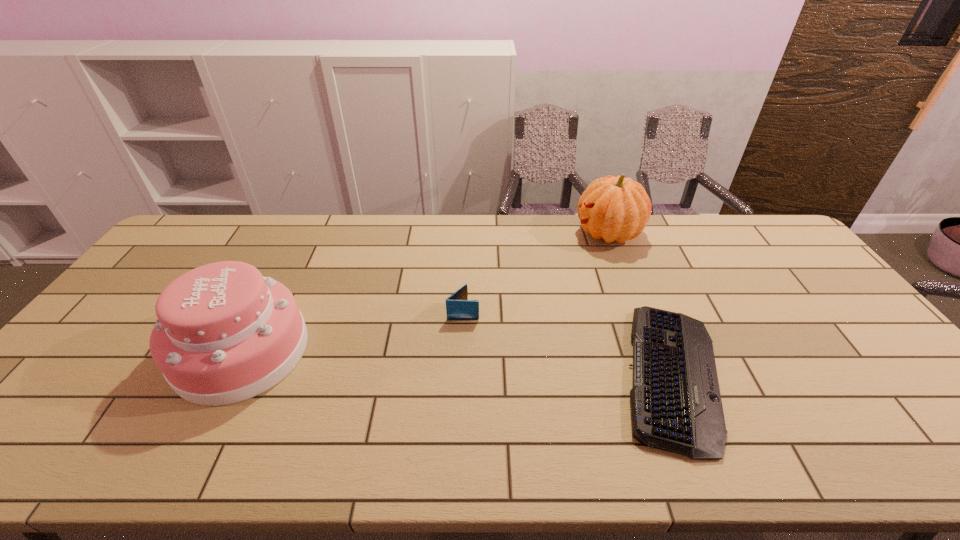
At what (x,y) coordinates should I click in order to perform the action: click on free point between the wallet and the birthday cake. Please return your answer as a coordinate pair (x, y). The image size is (960, 540). Looking at the image, I should click on (352, 331).

I want to click on free space between the birthday cake and the pumpkin, so click(x=425, y=292).

I want to click on free space between the computer keyboard and the second shortest object, so click(566, 343).

Where is `empty space between the birthday cake and the farthest object`? The height and width of the screenshot is (540, 960). empty space between the birthday cake and the farthest object is located at coordinates (425, 292).

The width and height of the screenshot is (960, 540). I want to click on free spot between the computer keyboard and the birthday cake, so click(x=456, y=363).

In order to click on vacant region between the farthest object and the computer keyboard in this screenshot , I will do `click(639, 304)`.

The image size is (960, 540). I want to click on vacant point located between the computer keyboard and the wallet, so click(566, 343).

Locate an element on the screen. The height and width of the screenshot is (540, 960). free point between the second object from left to right and the birthday cake is located at coordinates (352, 331).

Identify which object is the second closest to the wallet. Please provide its 2D coordinates. Your answer should be formatted as a tuple, i.e. [(x, y)], where the tuple contains the x and y coordinates of a point satisfying the conditions above.

[(224, 334)]

Select which object appears as the closest to the farthest object. Please provide its 2D coordinates. Your answer should be formatted as a tuple, i.e. [(x, y)], where the tuple contains the x and y coordinates of a point satisfying the conditions above.

[(676, 406)]